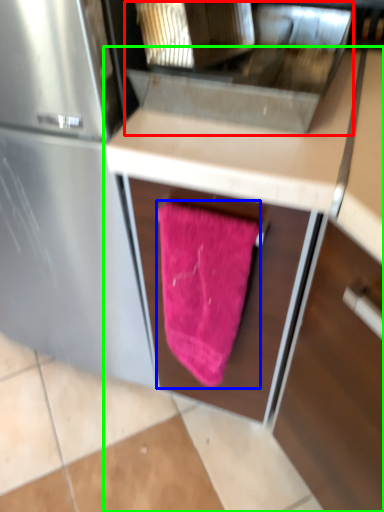
Question: Which object is positioned closest to sink (highlighted by a red box)? Select from beach towel (highlighted by a blue box) and cabinetry (highlighted by a green box).

Choices:
 (A) beach towel
 (B) cabinetry

Answer: (B)